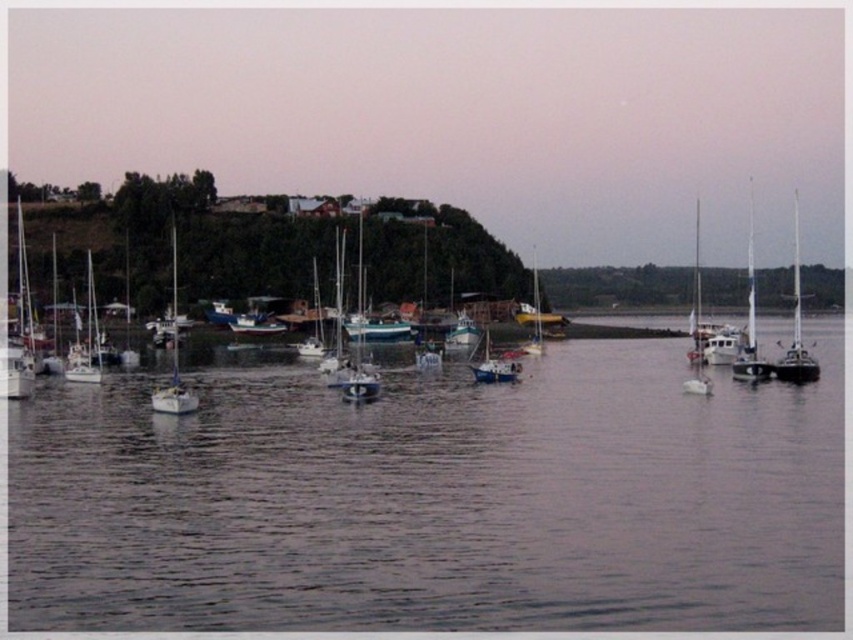
Question: Which object is farther from the camera taking this photo?

Choices:
 (A) shiny blue sailboat at center
 (B) dark gray water at center
 (C) white matte sailboat at center

Answer: (A)

Question: Which object is positioned closest to the shiny blue sailboat at center?

Choices:
 (A) white matte sailboat at right
 (B) dark gray water at center
 (C) white matte sailboat at left
 (D) white matte sailboat at center

Answer: (D)

Question: Is the position of white matte sailboat at left less distant than that of white matte sailboat at center?

Choices:
 (A) yes
 (B) no

Answer: (B)

Question: Can you confirm if white matte sailboat at center is bigger than shiny blue sailboat at center?

Choices:
 (A) yes
 (B) no

Answer: (A)

Question: Can you confirm if dark gray water at center is positioned to the right of shiny blue sailboat at center?

Choices:
 (A) yes
 (B) no

Answer: (B)

Question: Which of the following is the farthest from the observer?

Choices:
 (A) (86, 310)
 (B) (454, 348)
 (C) (795, 256)
 (D) (489, 356)

Answer: (C)